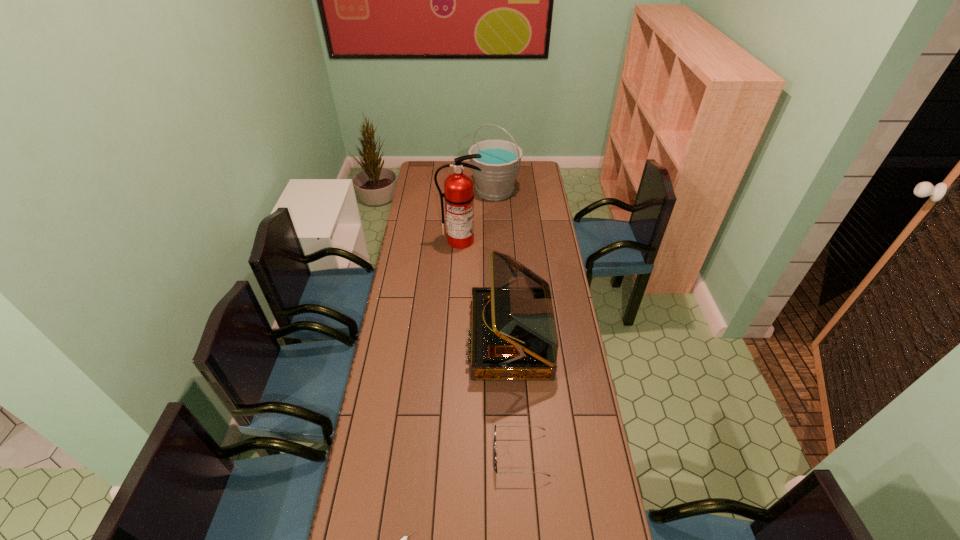
Locate an element on the screen. free space located 0.300m on the front-facing side of the third shortest object is located at coordinates (393, 339).

Identify the location of vacant region located on the front-facing side of the third shortest object. Image resolution: width=960 pixels, height=540 pixels. (448, 339).

Find the location of a particular element. vacant space situated 0.280m on the front-facing side of the third shortest object is located at coordinates (397, 339).

Where is `vacant region located 0.160m through the lenses of the second nearest object`? The width and height of the screenshot is (960, 540). vacant region located 0.160m through the lenses of the second nearest object is located at coordinates coord(444,455).

Locate an element on the screen. This screenshot has height=540, width=960. vacant area situated 0.160m through the lenses of the second nearest object is located at coordinates (444, 455).

The height and width of the screenshot is (540, 960). Identify the location of vacant region located through the lenses of the second nearest object. (407, 455).

Identify the location of object that is at the far edge. The height and width of the screenshot is (540, 960). (500, 163).

Identify the location of bucket situated at the right edge. (500, 163).

You are a GUI agent. You are given a task and a screenshot of the screen. Output one action in this format:
    pyautogui.click(x=<x>, y=<y>)
    Task: Click on the record player at the right edge
    This screenshot has height=540, width=960.
    Given the screenshot: What is the action you would take?
    pyautogui.click(x=514, y=336)

Where is `object that is positioned at the far right corner`? This screenshot has height=540, width=960. object that is positioned at the far right corner is located at coordinates (500, 163).